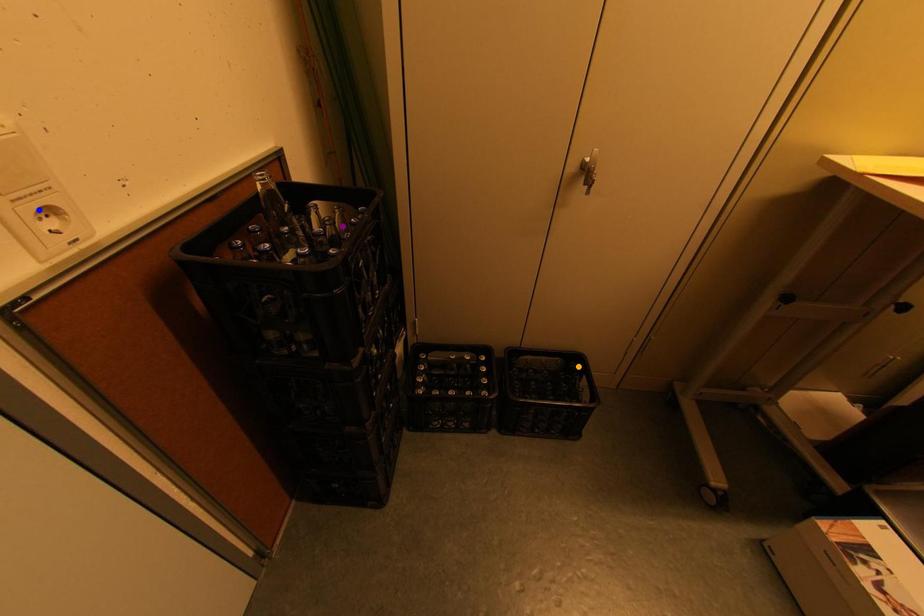
Order these from nearest to farthest:
orange point
purple point
blue point

1. orange point
2. purple point
3. blue point